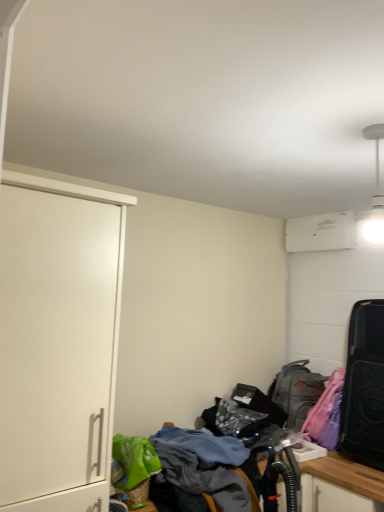
Question: Is gray fabric backpack at lower right taller or shorter than black matte suitcase at right?

Choices:
 (A) tall
 (B) short

Answer: (B)

Question: Based on their positions, is gray fabric backpack at lower right located to the left or right of black matte suitcase at right?

Choices:
 (A) left
 (B) right

Answer: (A)

Question: Considering the real-world distances, which object is closest to the gray fabric backpack at lower right?

Choices:
 (A) white matte cabinet at left
 (B) textured fabric desk at lower center
 (C) black matte suitcase at right

Answer: (C)

Question: Estimate the real-world distances between objects in this image. Which object is farther from the black matte suitcase at right?

Choices:
 (A) white matte cabinet at left
 (B) gray fabric backpack at lower right
 (C) textured fabric desk at lower center

Answer: (A)